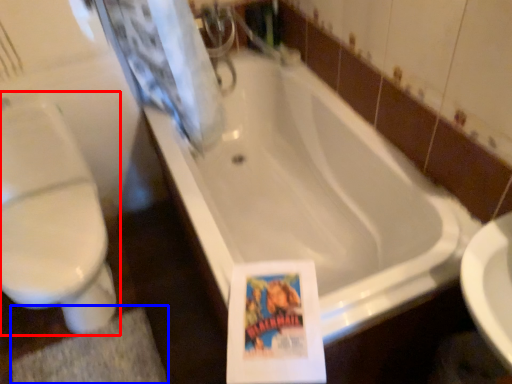
Question: Which object appears farthest to the camera in this image, toilet (highlighted by a red box) or bath mat (highlighted by a blue box)?

Choices:
 (A) toilet
 (B) bath mat

Answer: (B)